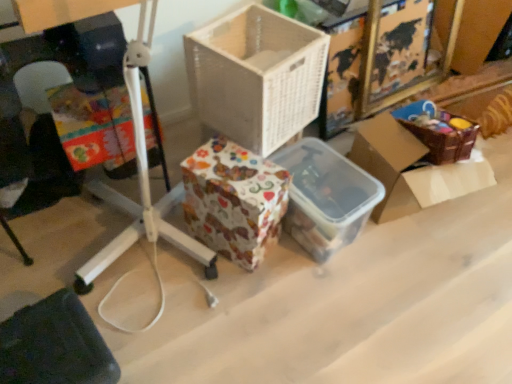
Question: In terms of width, does white wicker basket at center, the second box in the right-to-left sequence, look wider or thinner when compared to brown woven basket at upper right, the 2th box positioned from the left?

Choices:
 (A) wide
 (B) thin

Answer: (B)

Question: From their relative heights in the image, would you say white wicker basket at center, the second box in the right-to-left sequence, is taller or shorter than brown woven basket at upper right, positioned as the first box in right-to-left order?

Choices:
 (A) tall
 (B) short

Answer: (B)

Question: Considering the real-world distances, which object is farthest from the patterned paper storage box at center, positioned as the 2th storage box in right-to-left order?

Choices:
 (A) translucent plastic container at center, which is the 2th storage box from left to right
 (B) dark fabric at lower left
 (C) white wicker basket at center, the second box in the right-to-left sequence
 (D) brown woven basket at upper right, the 2th box positioned from the left

Answer: (B)

Question: Which is farther from the dark fabric at lower left?

Choices:
 (A) patterned paper storage box at center, positioned as the 2th storage box in right-to-left order
 (B) brown woven basket at upper right, the 2th box positioned from the left
 (C) white wicker basket at center, the 1th box when ordered from left to right
 (D) translucent plastic container at center, which is the 2th storage box from left to right

Answer: (B)